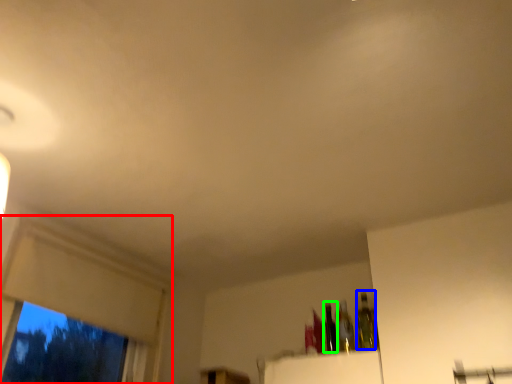
Question: Which object is the farthest from window frame (highlighted by a red box)? Choose among these: bottle (highlighted by a blue box) or bottle (highlighted by a green box).

Choices:
 (A) bottle
 (B) bottle

Answer: (A)